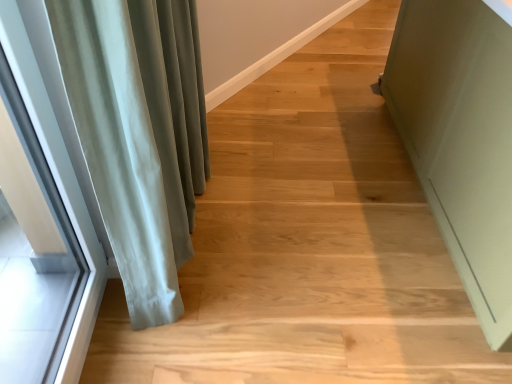
The image size is (512, 384). I want to click on free spot to the right of clear glass window at left, so click(x=176, y=341).